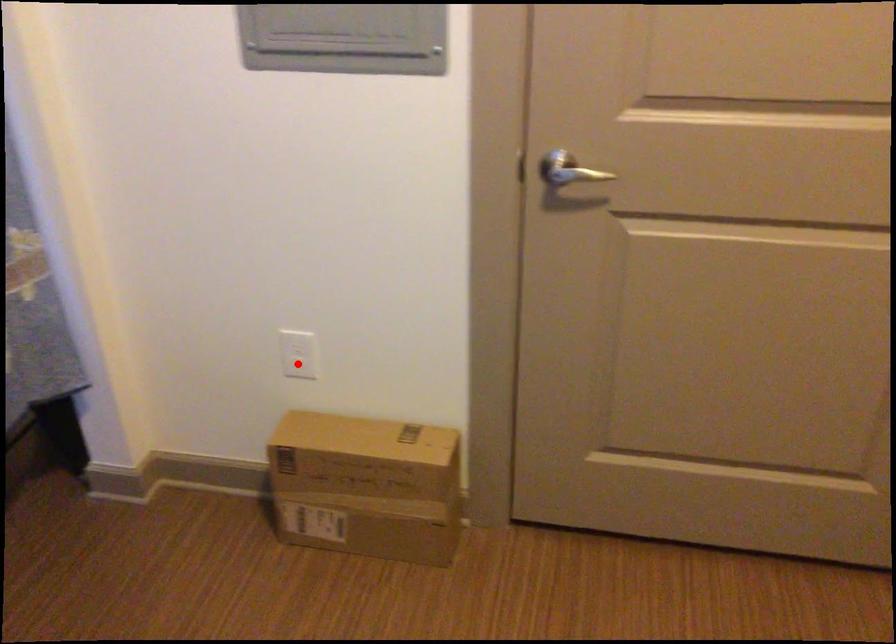
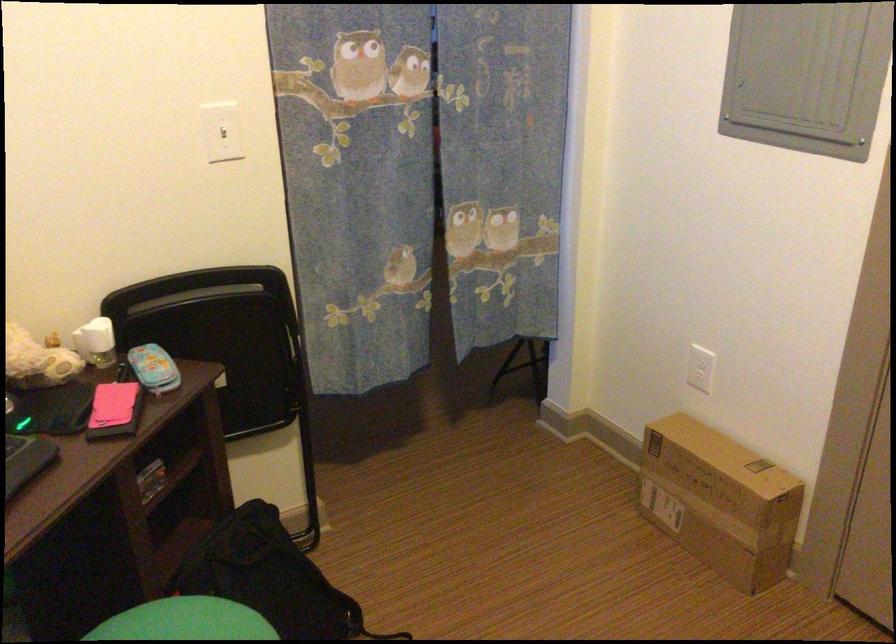
Question: I am providing you with two images of the same scene from different viewpoints. A red point is marked on the first image. Can you still see the location of the red point in image 2?

Choices:
 (A) Yes
 (B) No

Answer: (A)